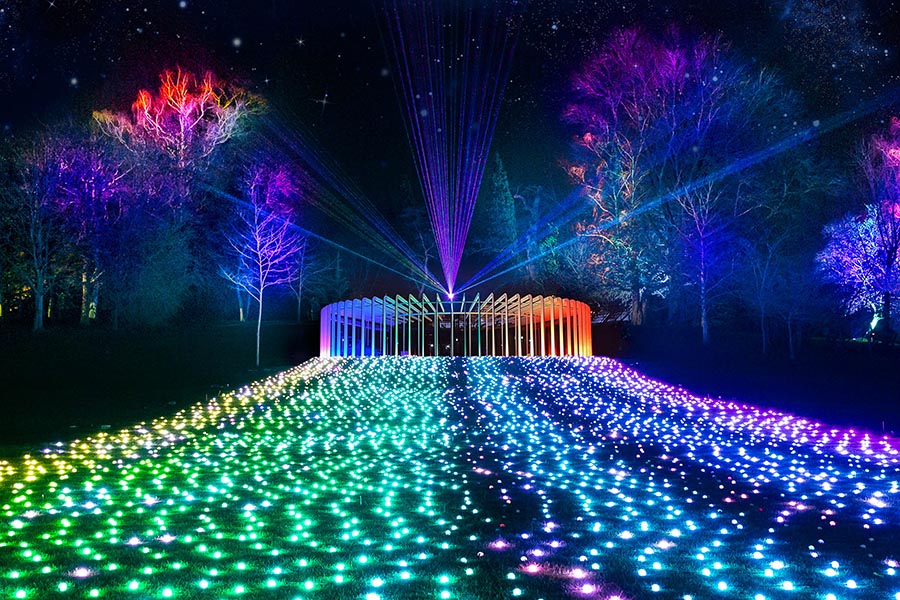
Find the location of a particular element. left section of lights is located at coordinates (189, 461).